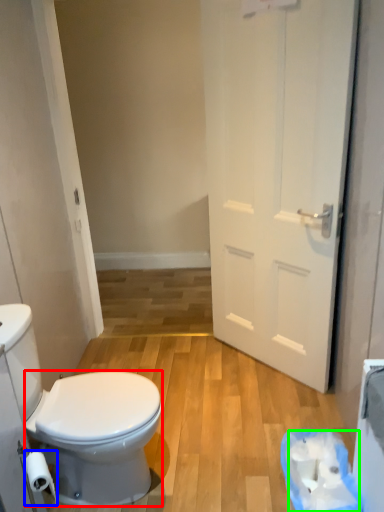
Question: Estimate the real-world distances between objects in this image. Which object is closer to bidet (highlighted by a red box), toilet paper (highlighted by a blue box) or toilet paper (highlighted by a green box)?

Choices:
 (A) toilet paper
 (B) toilet paper

Answer: (A)